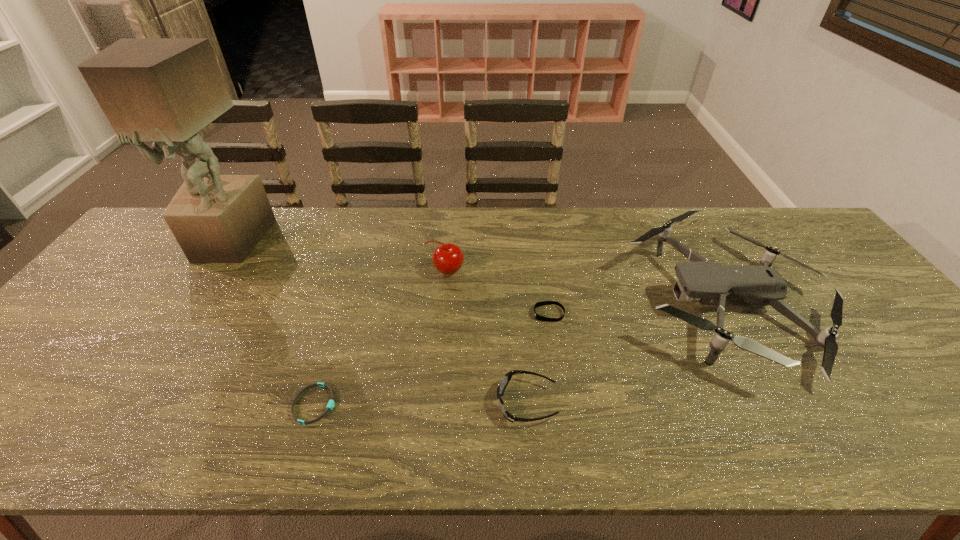
Locate an element on the screen. This screenshot has width=960, height=540. sculpture is located at coordinates (163, 90).

The height and width of the screenshot is (540, 960). Identify the location of the leftmost object. (163, 90).

Identify the location of the rightmost object. (711, 284).

This screenshot has height=540, width=960. Find the location of `the third object from left to right`. the third object from left to right is located at coordinates (448, 258).

In order to click on the fourth tallest object in this screenshot , I will do `click(507, 377)`.

The height and width of the screenshot is (540, 960). I want to click on the taller wristband, so click(x=542, y=303).

This screenshot has width=960, height=540. Identify the location of the farther wristband. (542, 303).

Identify the location of the left wristband. (331, 403).

Identify the location of the shorter wristband. (331, 403).

Find the location of a particular element. vacant region located on the front-facing side of the sculpture is located at coordinates (193, 296).